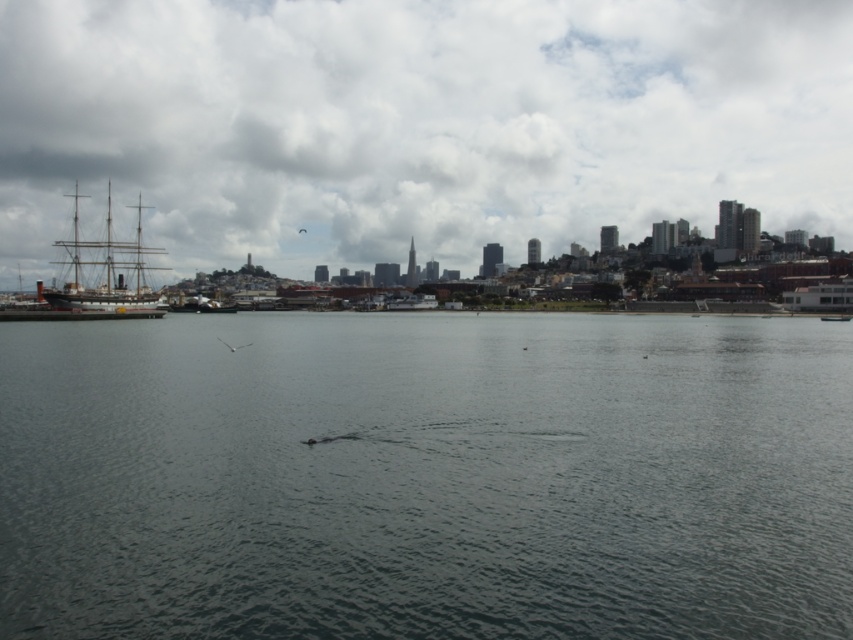
You are an architect designing a new observatory in the city. You want to ensure the observatory has a clear view of the cloudy sky at upper center. Given that the observatory will be built where the point at coordinates point (416, 124) is located, will the cityscape in the background block your view of the cloudy sky at upper center?

The point at coordinates point (416, 124) indicates cloudy sky at upper center, so building the observatory there would place it directly at the location of the cloudy sky at upper center. Therefore, the cityscape in the background would not block the view since the observatory would be positioned where the cloudy sky at upper center is located.

You are an observer standing on the pier looking out at the waterfront scene. You notice the cloudy sky at upper center and the wooden ship at left. Which object is located to the right of the other?

The cloudy sky at upper center is positioned on the right side of wooden ship at left, so the cloudy sky at upper center is to the right of the wooden ship at left.